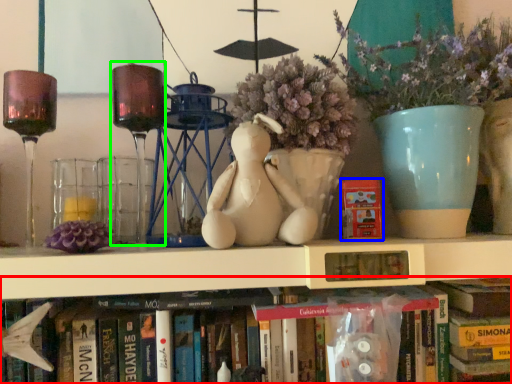
Question: Which is farther away from book (highlighted by a red box)? paperback book (highlighted by a blue box) or candle holder (highlighted by a green box)?

Choices:
 (A) paperback book
 (B) candle holder

Answer: (B)